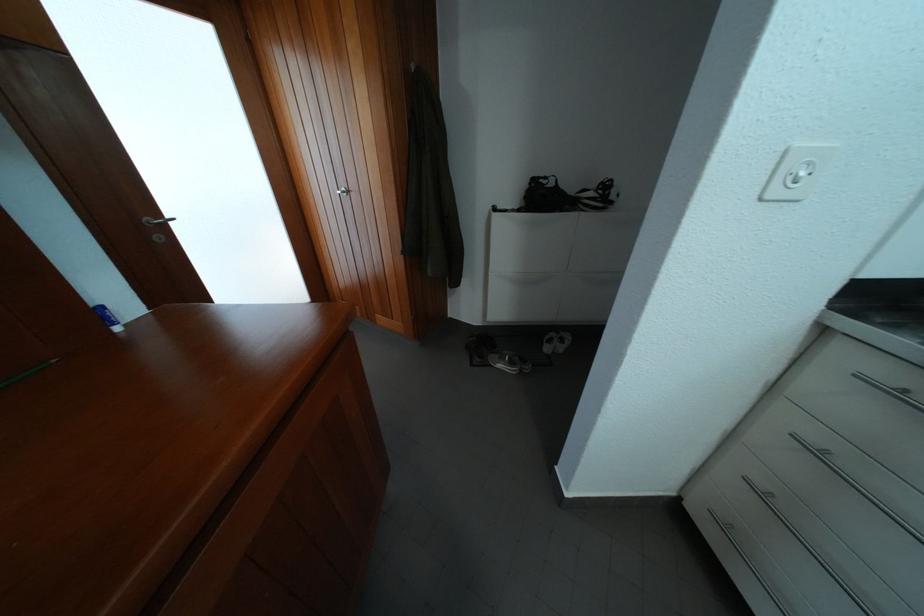
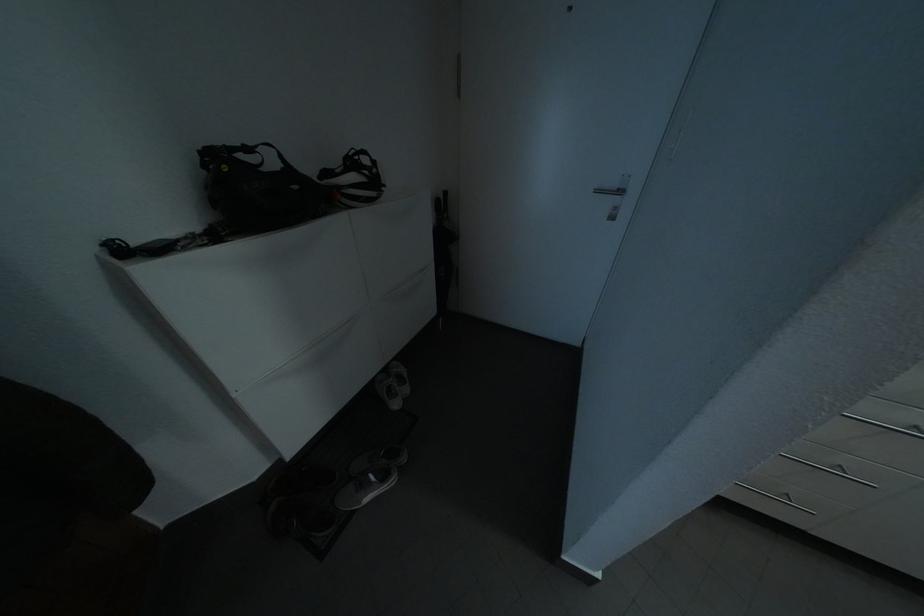
Based on the continuous images, in which direction is the camera rotating?

The camera rotated toward right-down.